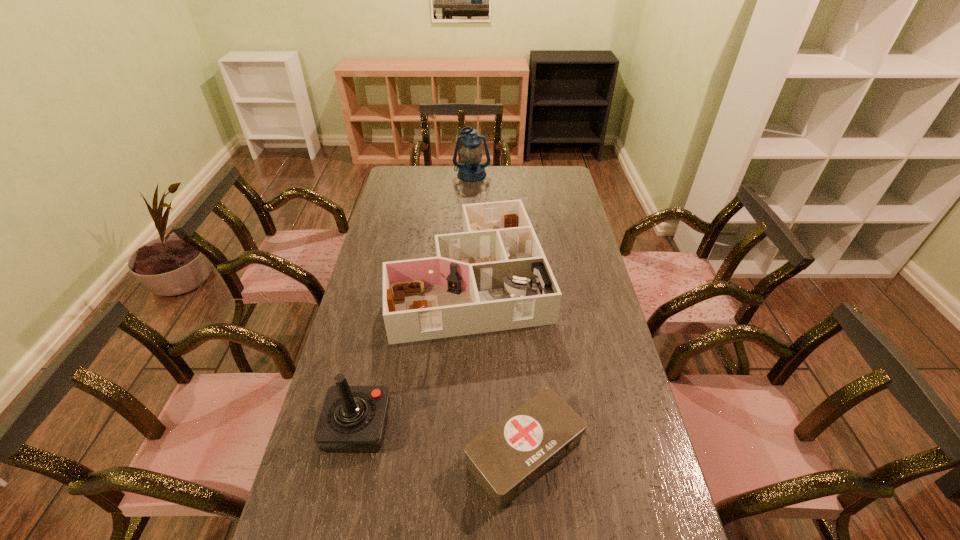
This screenshot has width=960, height=540. I want to click on lantern, so (471, 170).

I want to click on joystick, so click(353, 418).

Locate an element on the screen. the third tallest object is located at coordinates click(493, 276).

This screenshot has width=960, height=540. What are the coordinates of `dollhouse` in the screenshot? It's located at (493, 276).

You are a GUI agent. You are given a task and a screenshot of the screen. Output one action in this format:
    pyautogui.click(x=<x>, y=<y>)
    Task: Click on the first-aid kit
    This screenshot has width=960, height=540.
    Given the screenshot: What is the action you would take?
    pyautogui.click(x=507, y=458)

Locate an element on the screen. Image resolution: width=960 pixels, height=540 pixels. vacant space located on the face of the farthest object is located at coordinates (470, 227).

The width and height of the screenshot is (960, 540). Find the location of `free space located 0.400m on the front-facing side of the joystick`. free space located 0.400m on the front-facing side of the joystick is located at coordinates (532, 427).

I want to click on vacant point located 0.160m on the front of the second farthest object, so click(468, 386).

Identify the location of vacant space located on the left of the shortest object. (396, 454).

Locate an element on the screen. This screenshot has height=540, width=960. object present at the far edge is located at coordinates (471, 170).